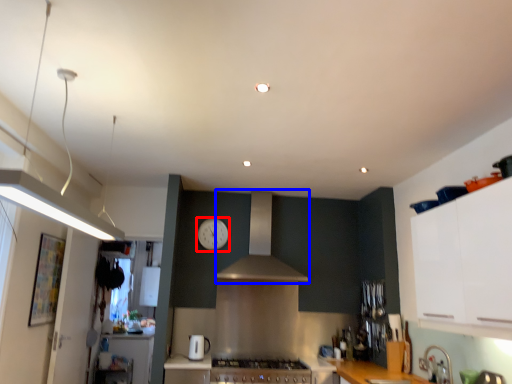
Question: Among these objects, which one is nearest to the camera, clock (highlighted by a red box) or hood (highlighted by a blue box)?

Choices:
 (A) clock
 (B) hood

Answer: (B)